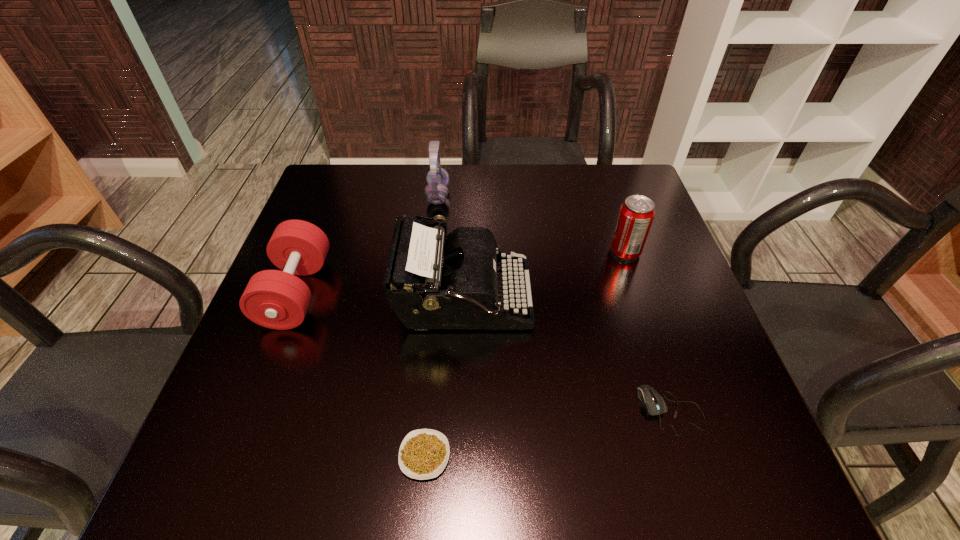
This screenshot has width=960, height=540. Find the location of `free location located on the right of the leftmost object`. free location located on the right of the leftmost object is located at coordinates (450, 292).

At what (x,y) coordinates should I click in order to perform the action: click on free region located 0.180m on the back of the computer mouse. Please return your answer as a coordinate pair (x, y). This screenshot has height=540, width=960. Looking at the image, I should click on (638, 309).

The height and width of the screenshot is (540, 960). Identify the location of vacant point located on the right of the legume. (662, 455).

Locate an element on the screen. Image resolution: width=960 pixels, height=540 pixels. object present at the far edge is located at coordinates (436, 192).

Identify the location of object situated at the near edge. (423, 454).

At what (x,y) coordinates should I click in order to perform the action: click on object that is at the left edge. Please return your answer as a coordinate pair (x, y). Looking at the image, I should click on (275, 299).

Locate an element on the screen. Image resolution: width=960 pixels, height=540 pixels. soda that is at the right edge is located at coordinates (636, 214).

The height and width of the screenshot is (540, 960). In order to click on computer mouse that is at the right edge in this screenshot , I will do `click(654, 404)`.

You are a GUI agent. You are given a task and a screenshot of the screen. Output one action in this format:
    pyautogui.click(x=<x>, y=<y>)
    Task: Click on the vacant space at the far edge of the desktop
    The height and width of the screenshot is (540, 960).
    Given the screenshot: What is the action you would take?
    pyautogui.click(x=392, y=189)

Image resolution: width=960 pixels, height=540 pixels. What are the coordinates of `free space at the near edge` in the screenshot? It's located at (625, 484).